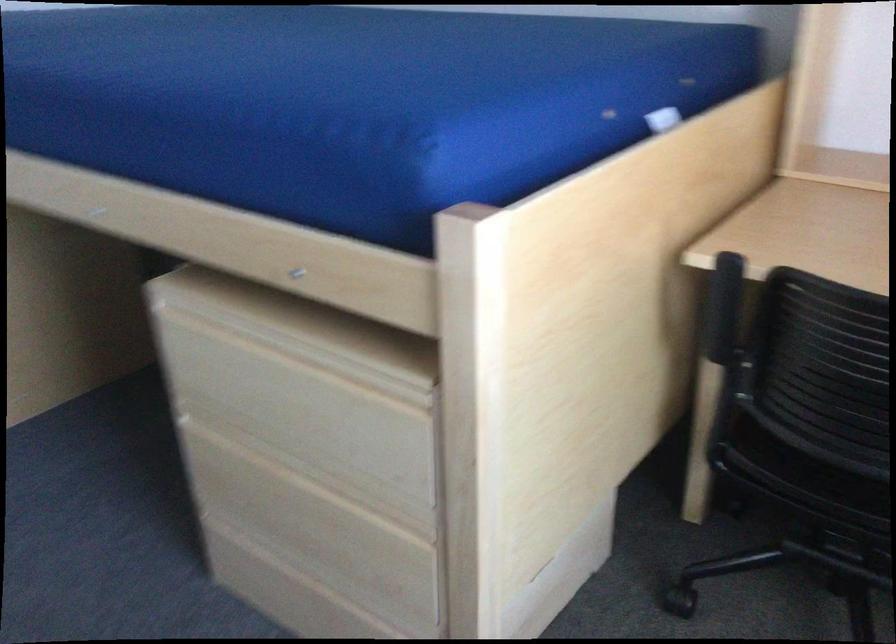
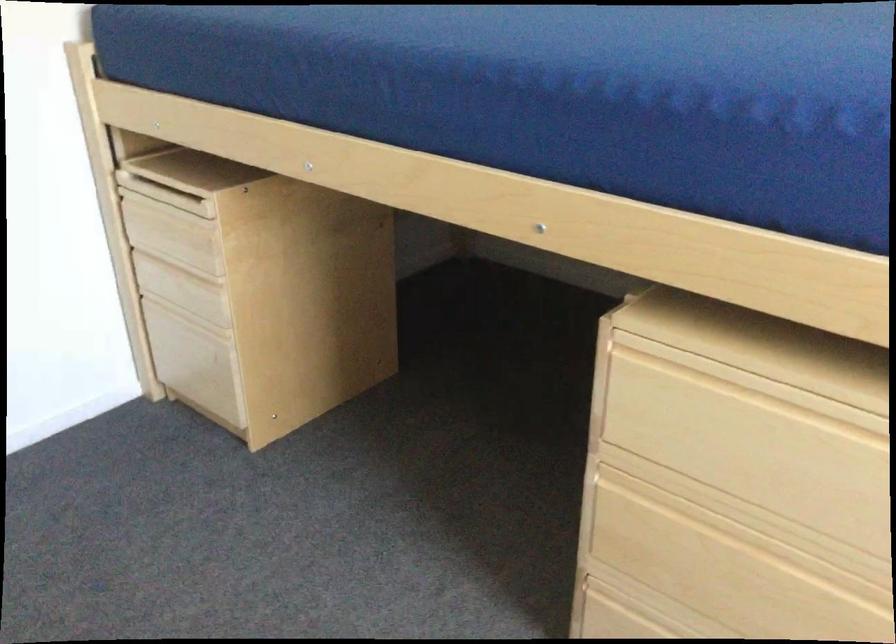
Question: The images are taken continuously from a first-person perspective. In which direction are you moving?

Choices:
 (A) Left
 (B) Right
 (C) Forward
 (D) Backward

Answer: (A)